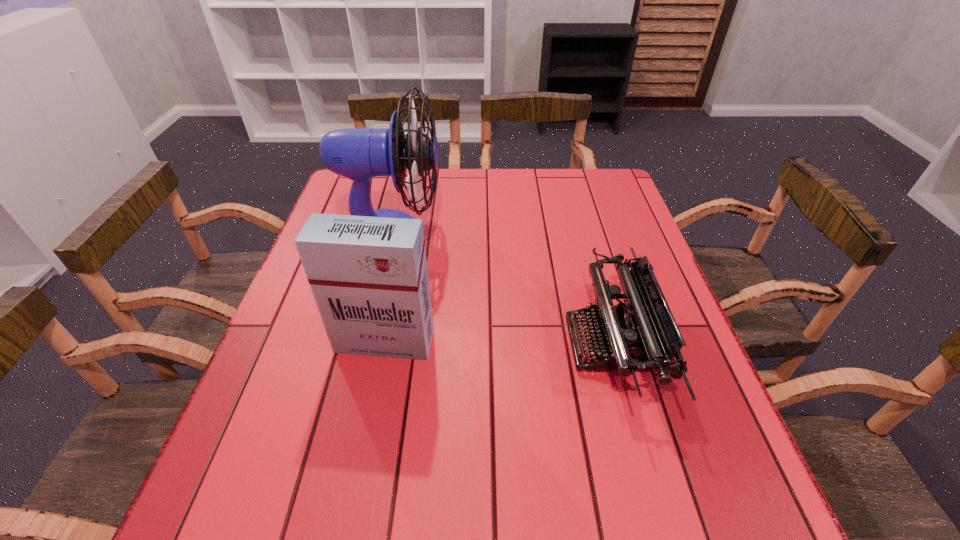
Locate an element on the screen. the tallest object is located at coordinates (359, 154).

This screenshot has width=960, height=540. Find the location of `fan`. fan is located at coordinates (359, 154).

The width and height of the screenshot is (960, 540). Find the location of `the second shortest object`. the second shortest object is located at coordinates (368, 275).

The height and width of the screenshot is (540, 960). I want to click on typewriter, so click(x=642, y=335).

In order to click on the shortest object in this screenshot , I will do `click(642, 335)`.

Where is `blank space located 0.190m in front of the farthest object where the airflow is directed`? Image resolution: width=960 pixels, height=540 pixels. blank space located 0.190m in front of the farthest object where the airflow is directed is located at coordinates (511, 233).

This screenshot has width=960, height=540. Find the location of `vacant space located 0.230m on the back of the second shortest object`. vacant space located 0.230m on the back of the second shortest object is located at coordinates (401, 258).

I want to click on blank space located on the typing side of the typewriter, so click(491, 343).

Find the location of a particular element. Image resolution: width=960 pixels, height=540 pixels. vacant space located 0.360m on the typing side of the typewriter is located at coordinates (402, 343).

This screenshot has width=960, height=540. I want to click on vacant region located on the typing side of the typewriter, so click(x=421, y=343).